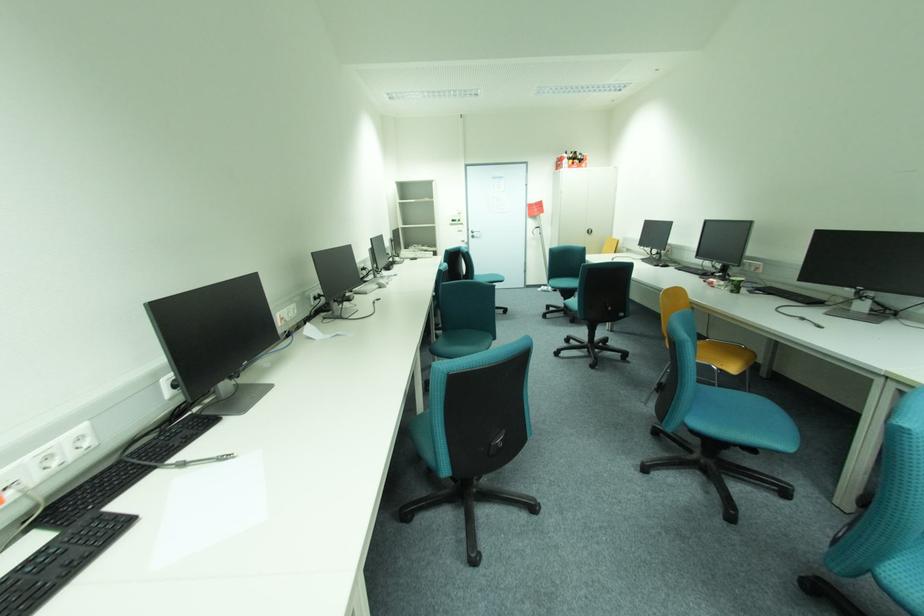
At what (x,y) coordinates should I click in order to perform the action: click on green paper cup. Please return your answer as a coordinate pair (x, y). Looking at the image, I should click on (735, 284).